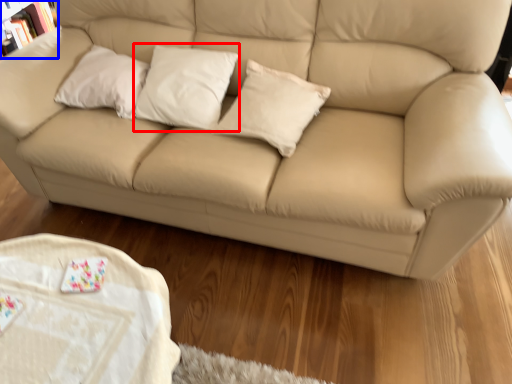
Question: Which object is closer to the camera taking this photo, pillow (highlighted by a red box) or bookcase (highlighted by a blue box)?

Choices:
 (A) pillow
 (B) bookcase

Answer: (A)